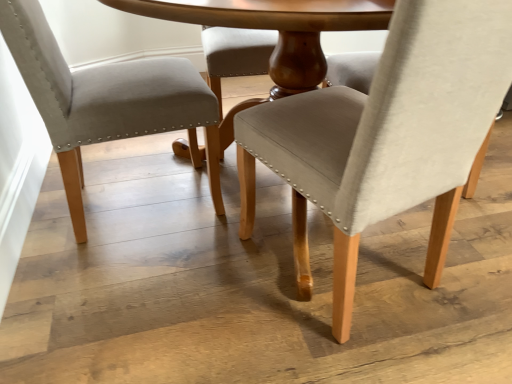
Where is `free spot to the right of matte beige fabric chair at center, marked as the 1th chair in a right-to-left arrangement`? This screenshot has width=512, height=384. free spot to the right of matte beige fabric chair at center, marked as the 1th chair in a right-to-left arrangement is located at coordinates (466, 256).